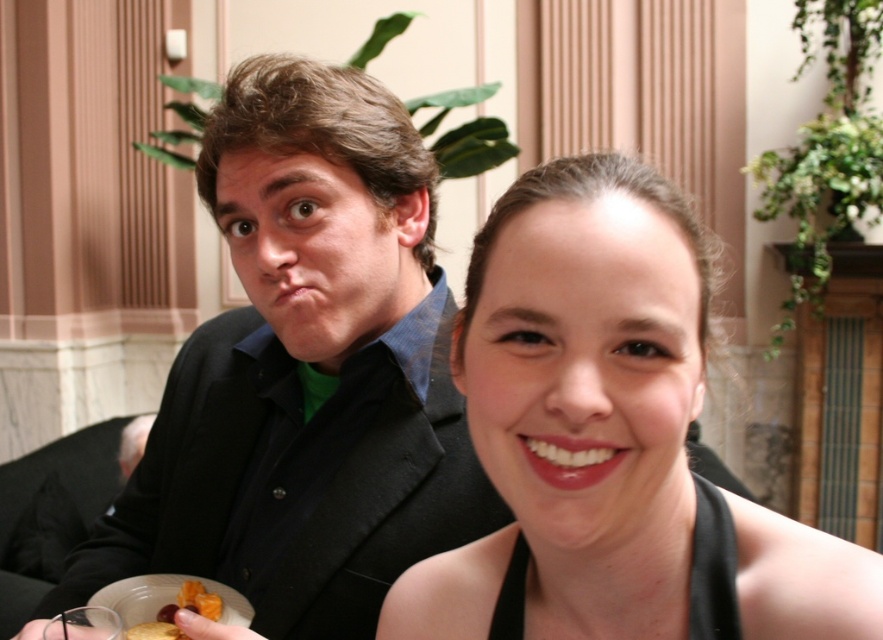
Question: Estimate the real-world distances between objects in this image. Which object is farther from the black satin dress at center?

Choices:
 (A) orange textured fruit at lower left
 (B) black matte suit at center

Answer: (A)

Question: Can you confirm if black matte suit at center is positioned below black satin dress at center?

Choices:
 (A) yes
 (B) no

Answer: (B)

Question: Where is black matte suit at center located in relation to black satin dress at center in the image?

Choices:
 (A) below
 (B) above

Answer: (B)

Question: Considering the relative positions of black matte suit at center and orange textured fruit at lower left in the image provided, where is black matte suit at center located with respect to orange textured fruit at lower left?

Choices:
 (A) right
 (B) left

Answer: (A)

Question: Which object is positioned farthest from the black satin dress at center?

Choices:
 (A) orange textured fruit at lower left
 (B) black matte suit at center

Answer: (A)

Question: Among these points, which one is farthest from the camera?

Choices:
 (A) (192, 589)
 (B) (371, 184)
 (C) (632, 561)

Answer: (A)